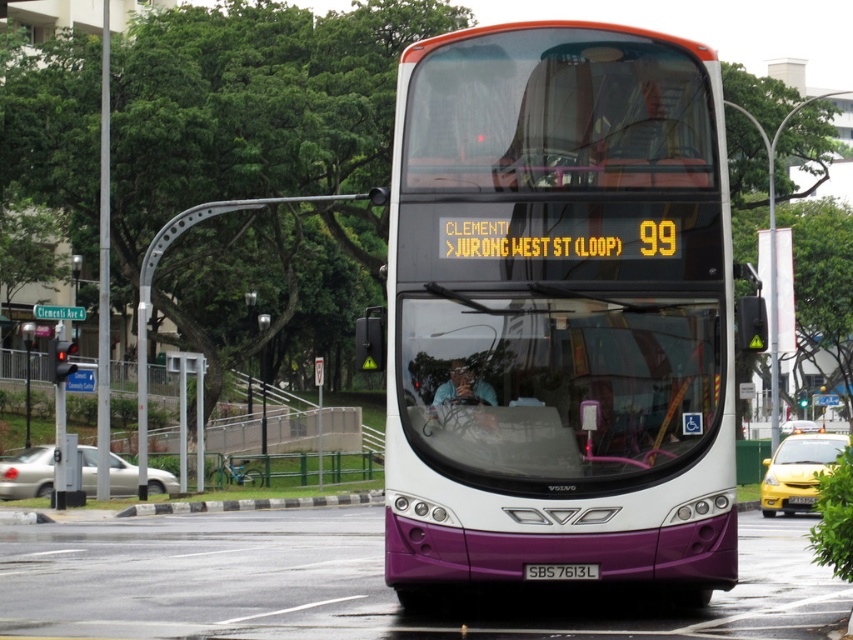
You are a delivery driver who needs to park your van next to the purple matte bus at center and the black rubber curb at lower center. Which object should you park closer to if you want to maximize the available parking space?

The purple matte bus at center occupies less space than the black rubber curb at lower center, so you should park closer to the black rubber curb at lower center to maximize available parking space.

You are a delivery driver approaching the intersection where the double decker bus is parked. You need to make a right turn onto the road ahead. Which object, the black rubber curb at lower center or the purple matte license plate at center, should you look for to determine the correct turning lane?

You should look for the black rubber curb at lower center because it is positioned to the left of the purple matte license plate at center, indicating the edge of the road where the turning lane might be located.